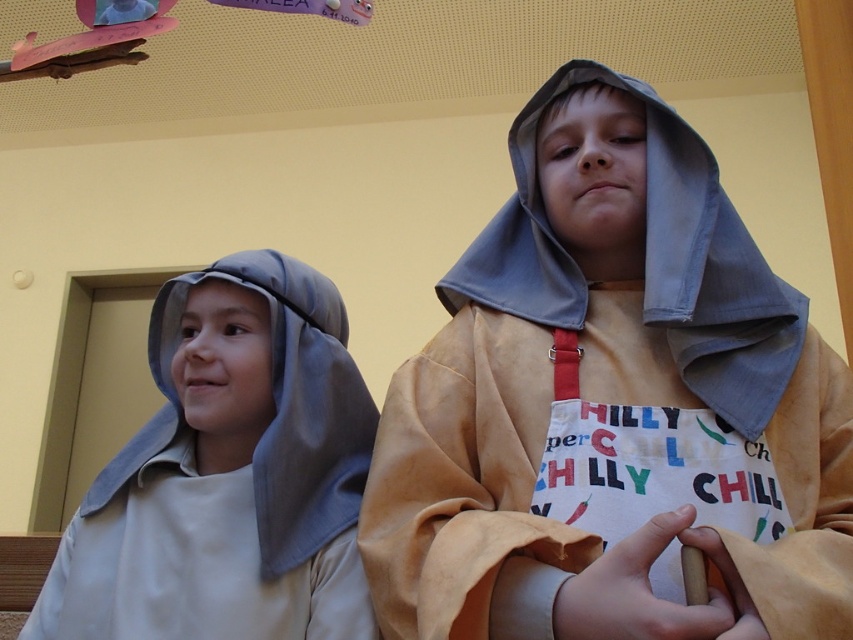
Question: Does light brown leather robe at center lie behind matte gray hood at left?

Choices:
 (A) no
 (B) yes

Answer: (A)

Question: Observing the image, what is the correct spatial positioning of light brown leather robe at center in reference to matte gray hood at left?

Choices:
 (A) right
 (B) left

Answer: (A)

Question: Which point is closer to the camera taking this photo?

Choices:
 (A) pyautogui.click(x=715, y=168)
 (B) pyautogui.click(x=276, y=413)

Answer: (A)

Question: Is light brown leather robe at center above matte gray hood at left?

Choices:
 (A) no
 (B) yes

Answer: (B)

Question: Which point is closer to the camera?

Choices:
 (A) light brown leather robe at center
 (B) matte gray hood at left

Answer: (A)

Question: Which object is farther from the camera taking this photo?

Choices:
 (A) light brown leather robe at center
 (B) matte gray hood at left

Answer: (B)